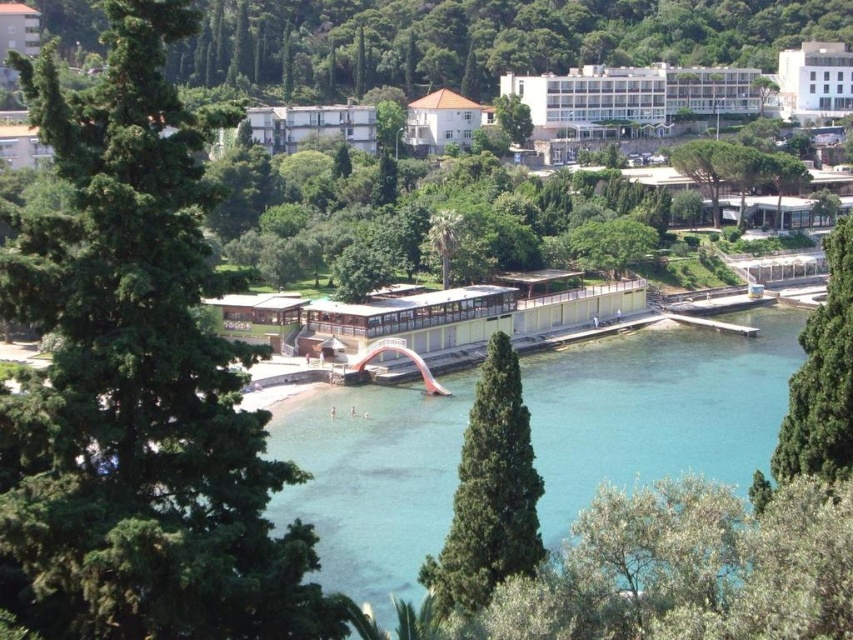
Question: Estimate the real-world distances between objects in this image. Which object is farther from the white concrete building at center?

Choices:
 (A) green leafy tree at center
 (B) green leafy tree at upper center
 (C) clear blue water at center
 (D) white smooth building at upper right

Answer: (D)

Question: Can you confirm if white smooth building at upper center is smaller than white smooth building at upper right?

Choices:
 (A) yes
 (B) no

Answer: (B)

Question: Does green textured tree at center appear over white smooth building at upper right?

Choices:
 (A) yes
 (B) no

Answer: (B)

Question: Which point appears farthest from the camera in this image?

Choices:
 (A) (250, 129)
 (B) (276, 499)

Answer: (A)

Question: Is the position of green leafy tree at right less distant than that of green leafy tree at upper center?

Choices:
 (A) yes
 (B) no

Answer: (A)

Question: Among these objects, which one is farthest from the camera?

Choices:
 (A) white concrete building at center
 (B) clear blue water at center
 (C) green leafy tree at right

Answer: (A)